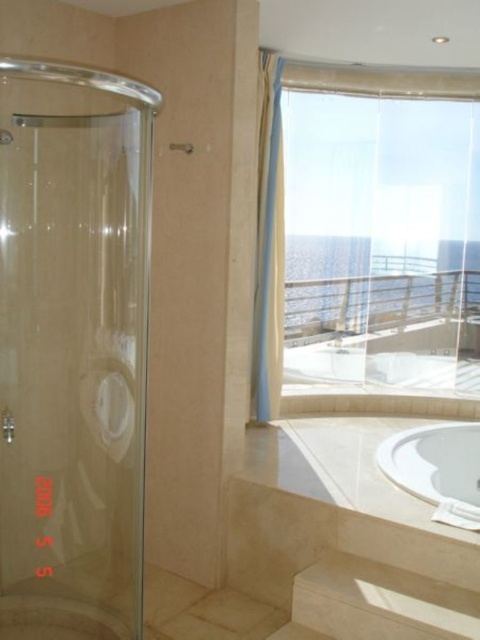
Is translucent fabric curtain at upper right further to camera compared to white glossy bathtub at lower right?

Yes, it is.

The image size is (480, 640). Describe the element at coordinates (382, 228) in the screenshot. I see `translucent fabric curtain at upper right` at that location.

Is point (396, 144) less distant than point (444, 476)?

That is False.

Identify the location of translucent fabric curtain at upper right. The image size is (480, 640). (382, 228).

Is point (464, 372) farther from viewer compared to point (269, 70)?

Yes, point (464, 372) is farther from viewer.

Who is more forward, [362,371] or [263,301]?

Positioned in front is point [263,301].

The height and width of the screenshot is (640, 480). In order to click on translucent fabric curtain at upper right in this screenshot , I will do `click(382, 228)`.

Is transparent glass shower at left smaller than white glossy bathtub at lower right?

Incorrect, transparent glass shower at left is not smaller in size than white glossy bathtub at lower right.

Where is `transparent glass shower at left`? This screenshot has width=480, height=640. transparent glass shower at left is located at coordinates (72, 348).

Is point (13, 408) behind point (442, 445)?

No, (13, 408) is closer to viewer.

Image resolution: width=480 pixels, height=640 pixels. In order to click on transparent glass shower at left in this screenshot , I will do `click(72, 348)`.